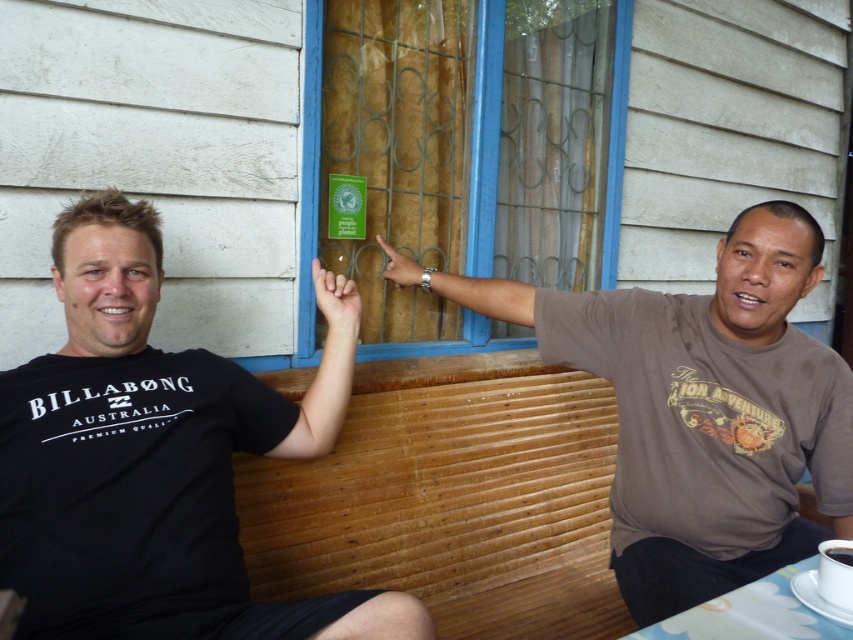
You are a visitor at this outdoor seating area and want to read the text on the green matte sign at upper center. However, you notice the black matte cup at lower right might be blocking your view. Based on their sizes, do you think you can see the entire sign without moving the cup?

The green matte sign at upper center has a greater height compared to the black matte cup at lower right. Since the sign is taller, it is likely that you can see the entire sign without moving the cup, as the cup is shorter and might not obstruct the full height of the sign.

You are a photographer standing in front of the scene. You want to take a photo that includes both the brown cotton shirt at center and the black matte cup at lower right. Which object should you focus on first to ensure both are in focus?

The brown cotton shirt at center is closer to you than the black matte cup at lower right. To ensure both are in focus, you should focus on the brown cotton shirt at center first, as it is the closer object.